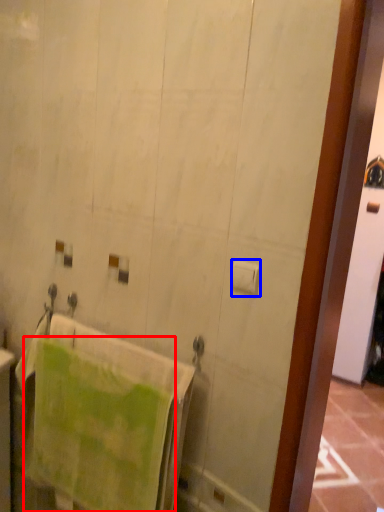
Question: Which point is further to the camera, towel (highlighted by a red box) or toilet paper (highlighted by a blue box)?

Choices:
 (A) towel
 (B) toilet paper

Answer: (A)